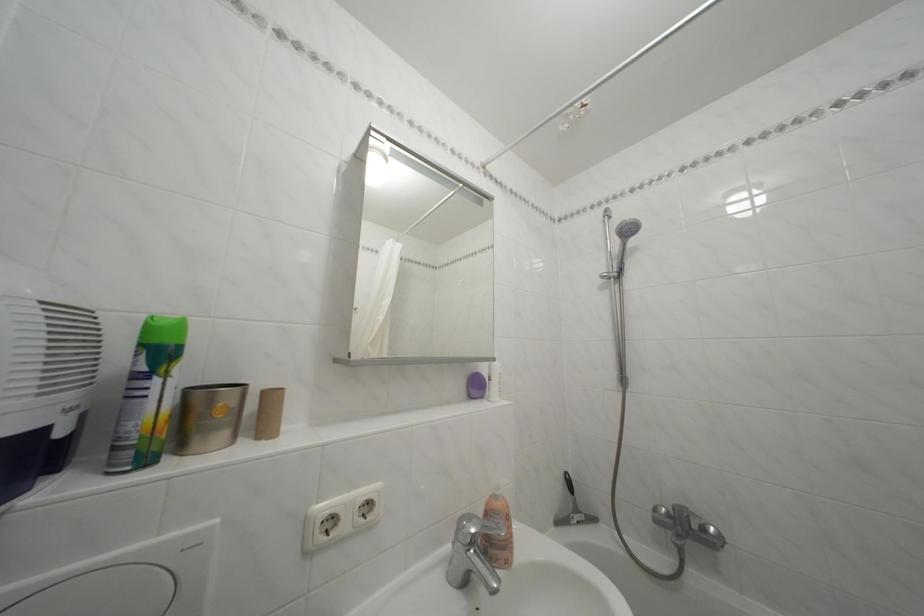
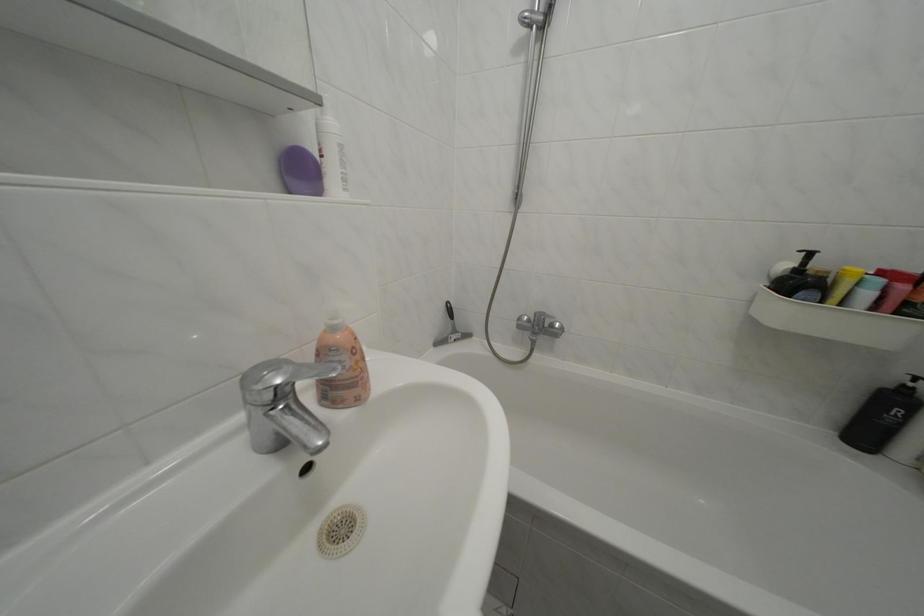
Locate, in the second image, the point that corresponds to the point at 505,504 in the first image.

(342, 334)